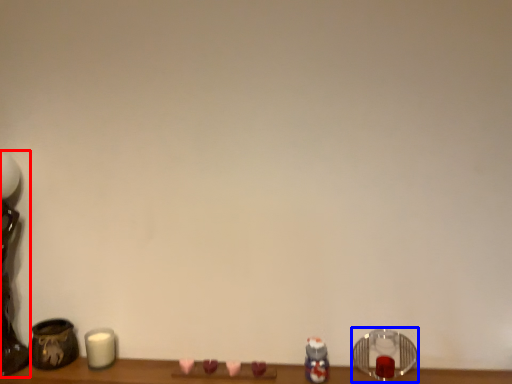
Question: Which object appears closest to the camera in this image, table lamp (highlighted by a red box) or candle holder (highlighted by a blue box)?

Choices:
 (A) table lamp
 (B) candle holder

Answer: (A)